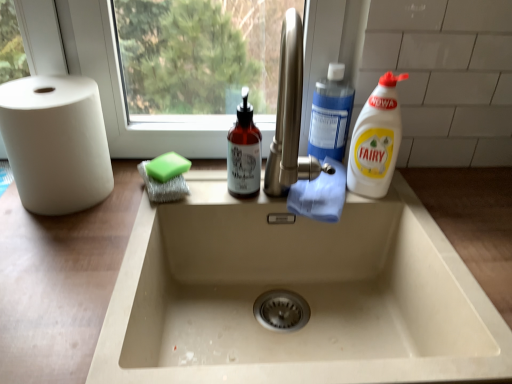
Locate an element on the screen. The height and width of the screenshot is (384, 512). vacant area located to the right-hand side of green sponge at upper left is located at coordinates click(227, 189).